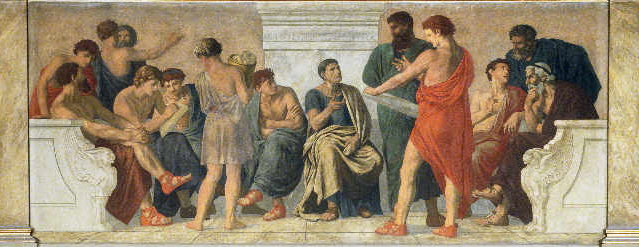
The height and width of the screenshot is (247, 639). Identify the location of bench. (56, 167), (572, 179).